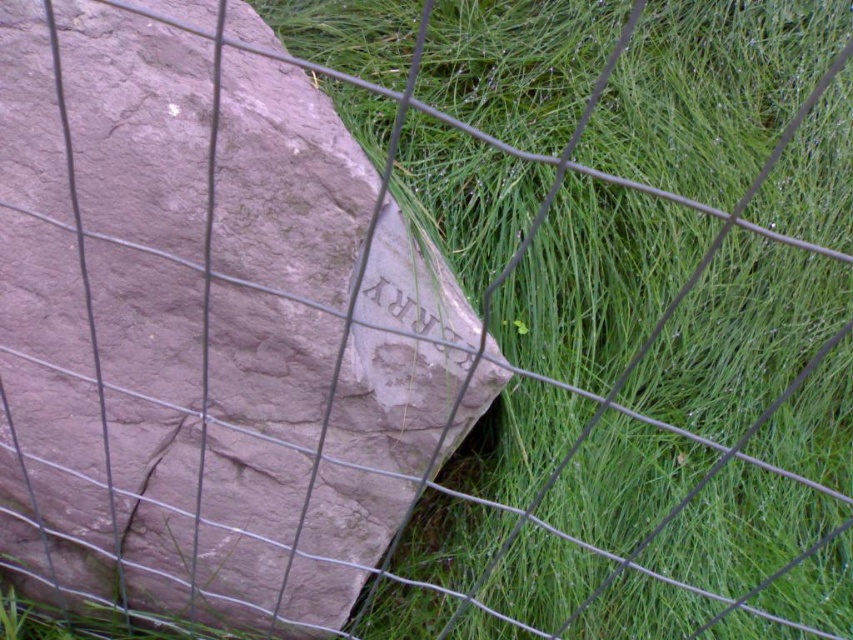
Question: Does green grass at center appear over rustic stone boulder at center?

Choices:
 (A) yes
 (B) no

Answer: (A)

Question: Which of the following is the closest to the observer?

Choices:
 (A) (422, 172)
 (B) (196, 349)

Answer: (B)

Question: Which of the following is the closest to the observer?

Choices:
 (A) green grass at center
 (B) rustic stone boulder at center

Answer: (B)

Question: Which point is closer to the camera?

Choices:
 (A) (346, 257)
 (B) (621, 481)

Answer: (A)

Question: Does green grass at center come in front of rustic stone boulder at center?

Choices:
 (A) no
 (B) yes

Answer: (A)

Question: In this image, where is green grass at center located relative to rustic stone boulder at center?

Choices:
 (A) above
 (B) below

Answer: (A)